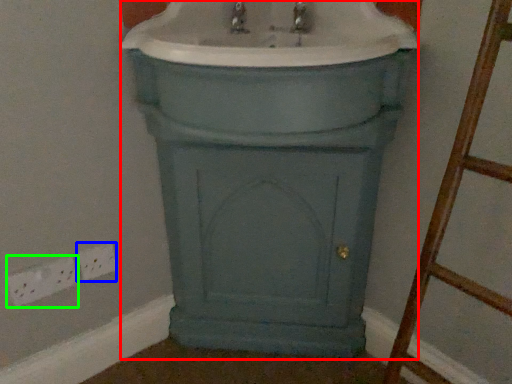
Question: Which is farther away from porcelain (highlighted by a red box)? electric outlet (highlighted by a blue box) or electric outlet (highlighted by a green box)?

Choices:
 (A) electric outlet
 (B) electric outlet

Answer: (B)